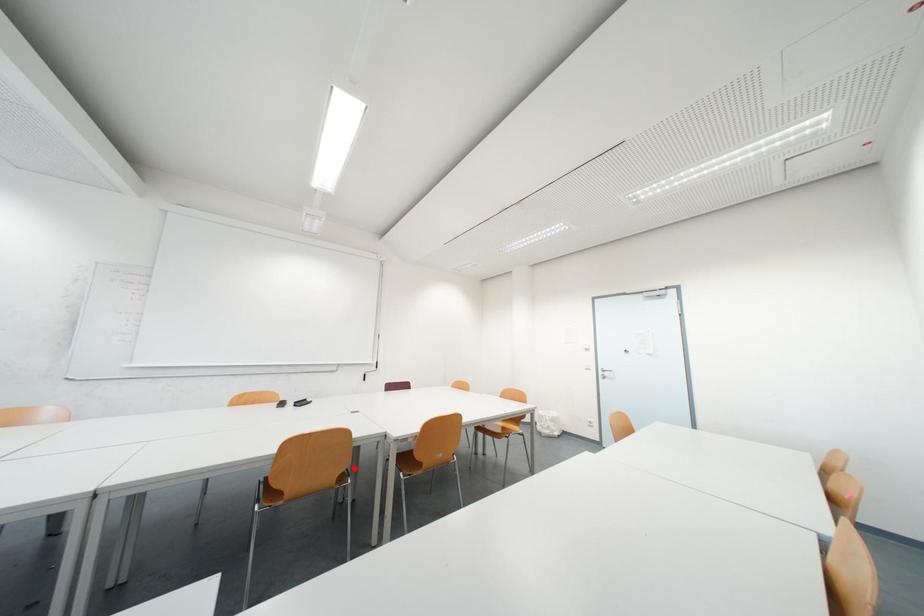
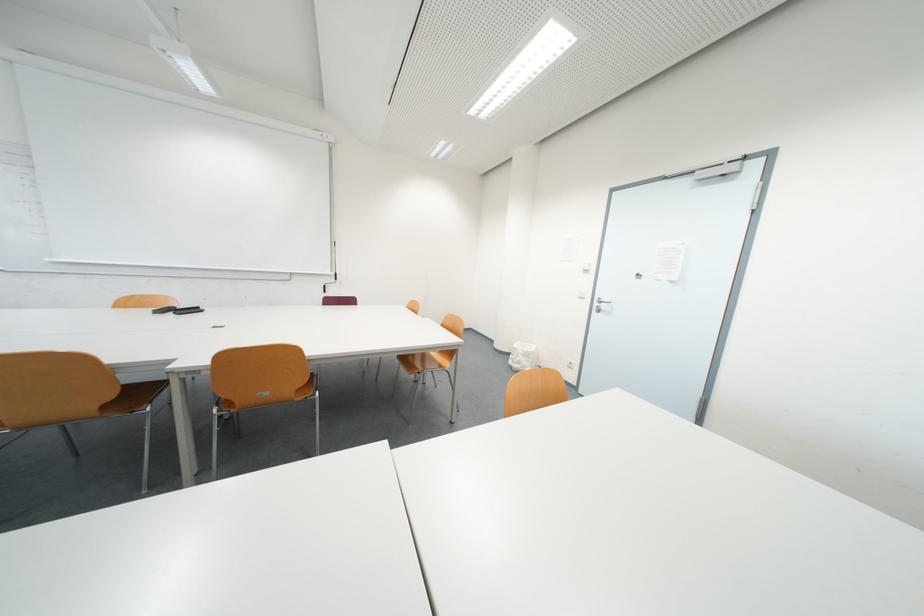
Question: I am providing you with two images of the same scene from different viewpoints. Given a red point in image1, look at the same physical point in image2. Is it:

Choices:
 (A) Closer to the viewpoint
 (B) Farther from the viewpoint

Answer: (A)